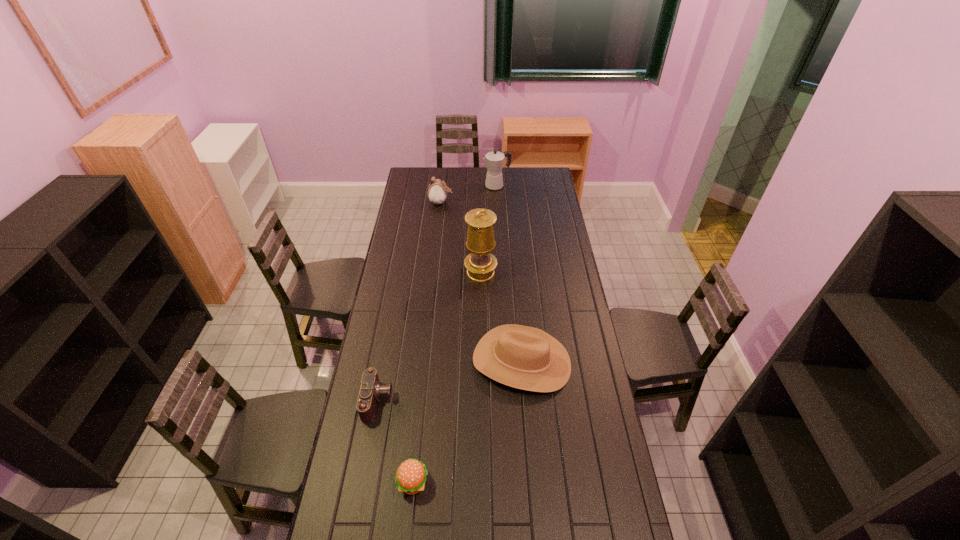
Identify the location of the fourth nearest object. (480, 263).

Image resolution: width=960 pixels, height=540 pixels. Find the location of `the tallest object`. the tallest object is located at coordinates (480, 263).

Locate an element on the screen. the second tallest object is located at coordinates (494, 160).

The image size is (960, 540). I want to click on coffeepot, so click(494, 160).

This screenshot has width=960, height=540. In order to click on the fifth nearest object in this screenshot , I will do pyautogui.click(x=437, y=193).

You are a GUI agent. You are given a task and a screenshot of the screen. Output one action in this format:
    pyautogui.click(x=<x>, y=<y>)
    Task: Click on the cowboy hat
    
    Given the screenshot: What is the action you would take?
    pyautogui.click(x=523, y=357)

Locate an element on the screen. hamburger is located at coordinates (410, 478).

Identify the location of camera. The height and width of the screenshot is (540, 960). (371, 389).

The height and width of the screenshot is (540, 960). I want to click on free space located 0.120m on the back of the tallest object, so click(481, 247).

At what (x,y) coordinates should I click in order to perform the action: click on free space located 0.080m on the left of the farthest object. Please return your answer as a coordinate pair (x, y). This screenshot has height=540, width=960. Looking at the image, I should click on (468, 186).